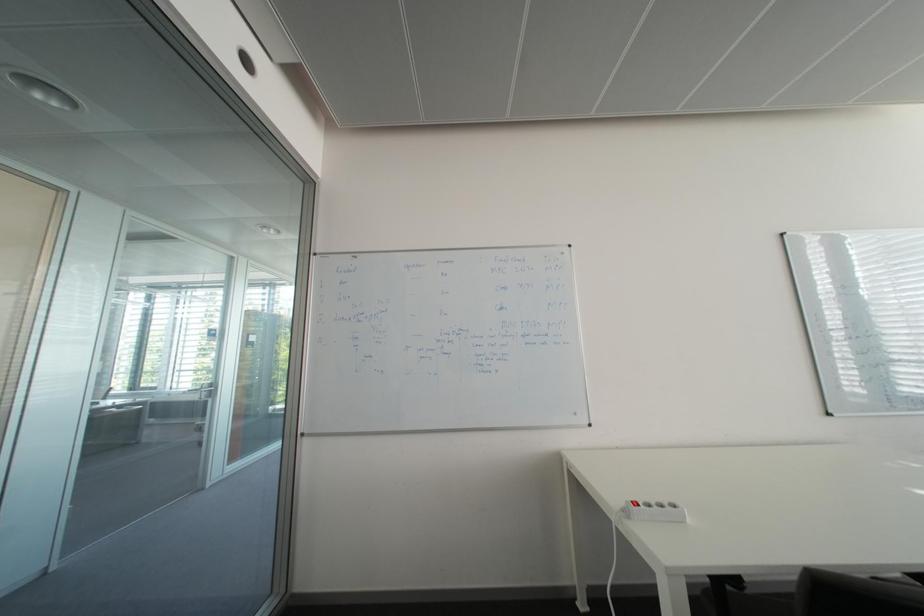
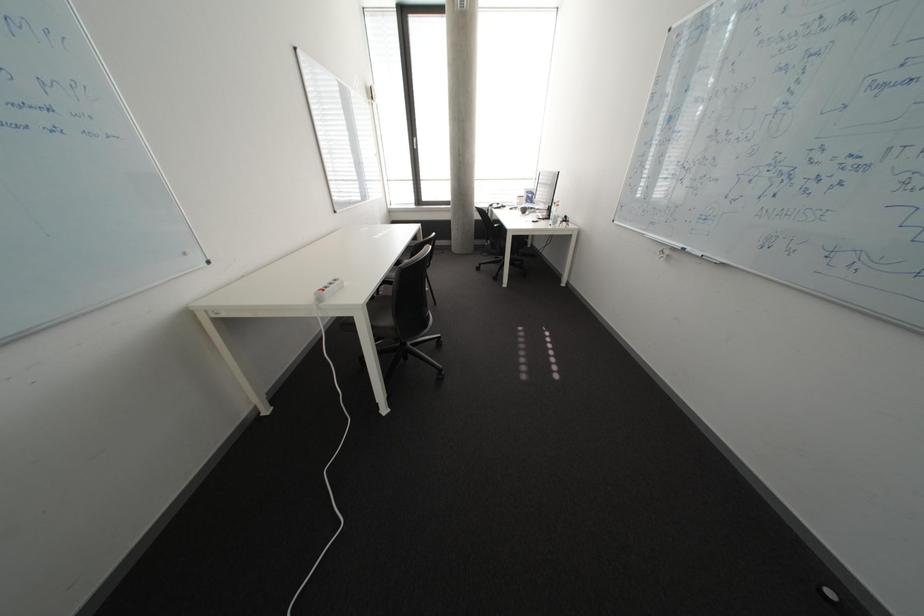
In the scene shown: First-person continuous shooting, in which direction is the camera rotating?

The camera's rotation is toward right-down.